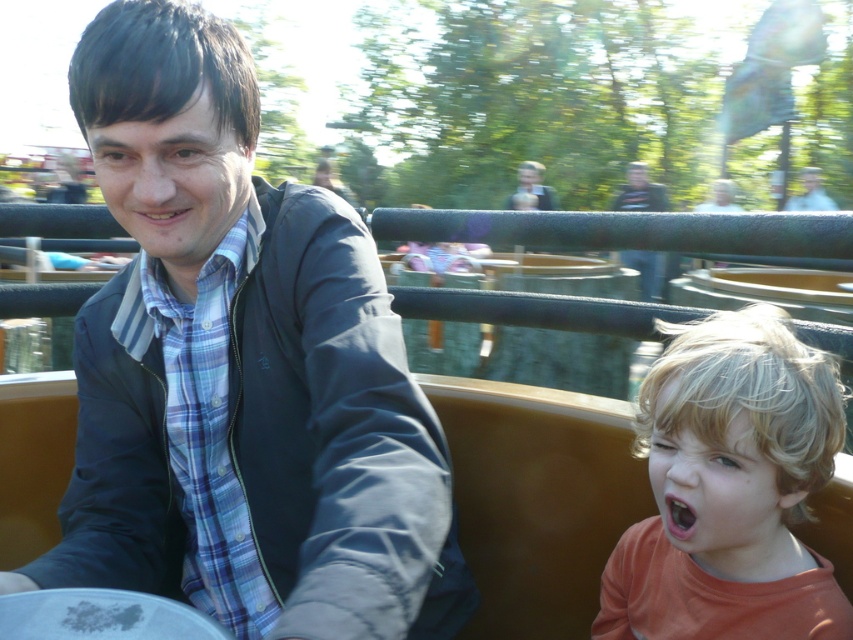
Question: Is blue plaid shirt at center below dark blue jacket at upper center?

Choices:
 (A) no
 (B) yes

Answer: (B)

Question: Which object is the closest to the blonde hair at lower right?

Choices:
 (A) orange matte mouth at lower right
 (B) matte blue shirt at upper center
 (C) dark blue jacket at upper center

Answer: (A)

Question: Is blonde hair at lower right below matte black jacket at upper center?

Choices:
 (A) yes
 (B) no

Answer: (A)

Question: Which is farther from the dark blue jacket at upper center?

Choices:
 (A) matte black jacket at upper center
 (B) orange matte mouth at lower right
 (C) blonde hair at lower right
 (D) matte blue shirt at upper center

Answer: (B)

Question: In this image, where is dark blue jacket at upper center located relative to orange matte mouth at lower right?

Choices:
 (A) above
 (B) below

Answer: (A)

Question: Which object appears closest to the camera in this image?

Choices:
 (A) matte black jacket at upper center
 (B) blue plaid shirt at center
 (C) dark blue jacket at upper center
 (D) blonde hair at lower right

Answer: (B)